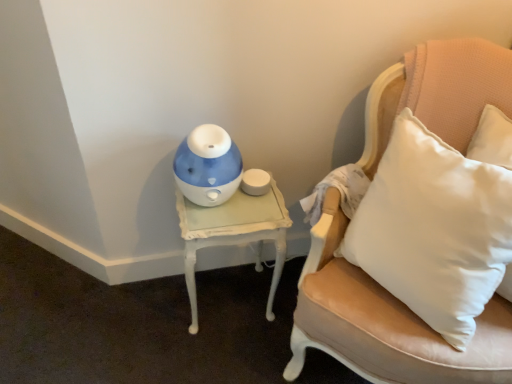
Question: Is leather cushion at right to the left or to the right of blue glossy humidifier at center in the image?

Choices:
 (A) left
 (B) right

Answer: (B)

Question: Based on their sizes in the image, would you say leather cushion at right is bigger or smaller than blue glossy humidifier at center?

Choices:
 (A) small
 (B) big

Answer: (B)

Question: Which object is positioned closest to the leather cushion at right?

Choices:
 (A) blue glossy humidifier at center
 (B) white painted wood table at left

Answer: (B)

Question: Which of these objects is positioned farthest from the white painted wood table at left?

Choices:
 (A) leather cushion at right
 (B) blue glossy humidifier at center

Answer: (A)